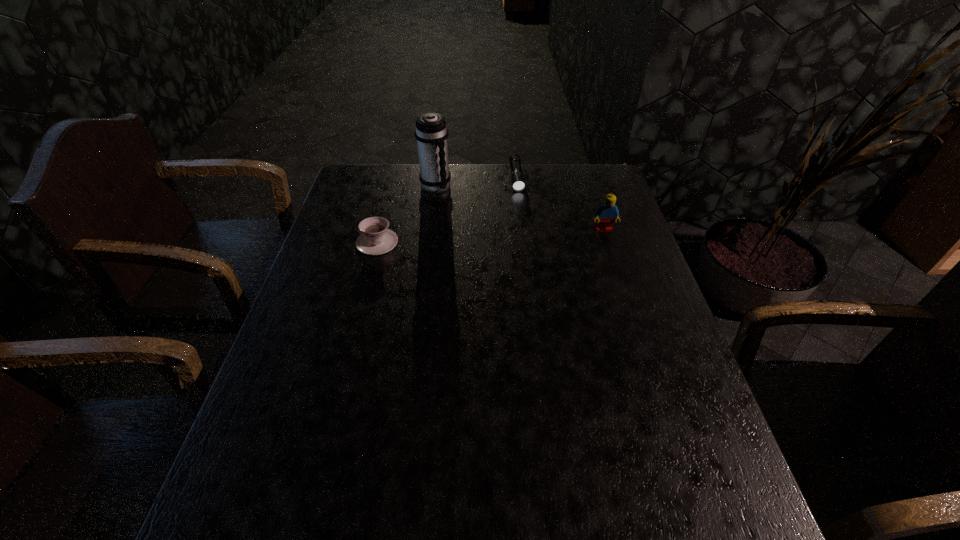
Where is `teacup`? teacup is located at coordinates (376, 239).

This screenshot has height=540, width=960. I want to click on the third tallest object, so click(376, 239).

Locate an element on the screen. Image resolution: width=960 pixels, height=540 pixels. Lego is located at coordinates (605, 214).

I want to click on the third shortest object, so click(605, 214).

At what (x,y) coordinates should I click in order to perform the action: click on thermos bottle. Please return your answer as a coordinate pair (x, y). Looking at the image, I should click on (431, 133).

The image size is (960, 540). I want to click on the tallest object, so click(431, 133).

I want to click on the shortest object, so click(x=517, y=178).

This screenshot has height=540, width=960. Find the location of `flashlight`. flashlight is located at coordinates (517, 178).

Find the location of a particular element. vacant space located 0.070m on the handle side of the third tallest object is located at coordinates (332, 242).

This screenshot has height=540, width=960. I want to click on vacant space situated on the handle side of the third tallest object, so click(336, 242).